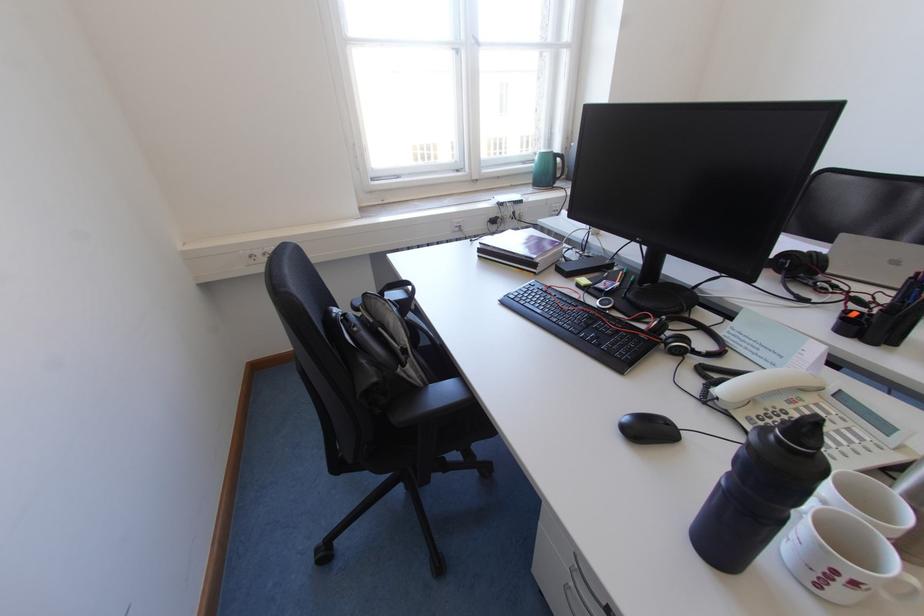
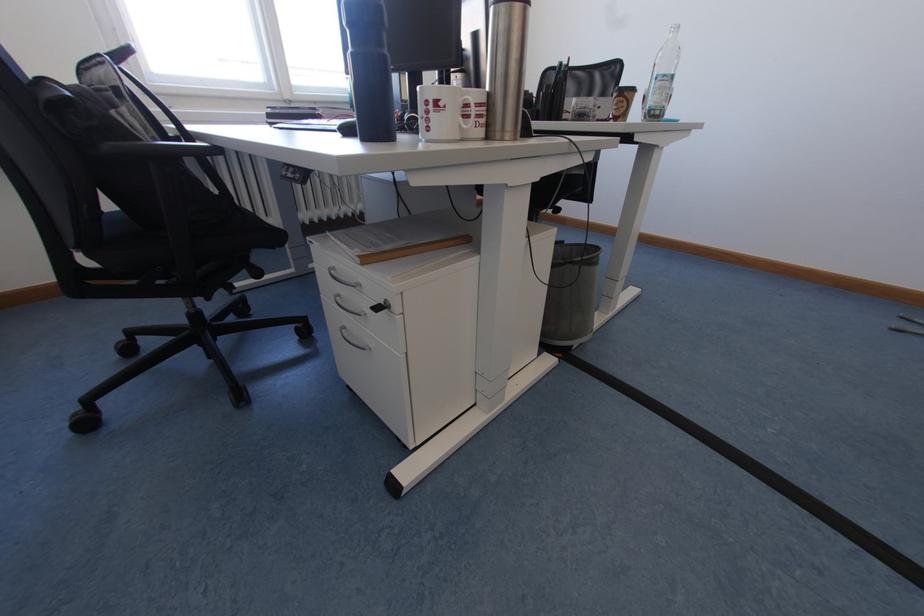
Question: The camera is either moving clockwise (left) or counter-clockwise (right) around the object. The first image is from the beginning of the video and the second image is from the end. Is the camera moving left or right when shooting the video?

Choices:
 (A) Left
 (B) Right

Answer: (A)